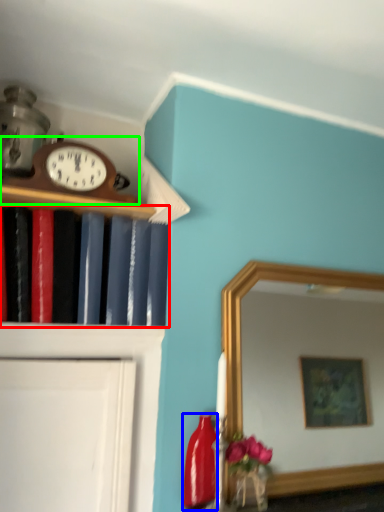
Question: Which is nearer to the book (highlighted by a red box)? bottle (highlighted by a blue box) or wall clock (highlighted by a green box).

Choices:
 (A) bottle
 (B) wall clock

Answer: (B)